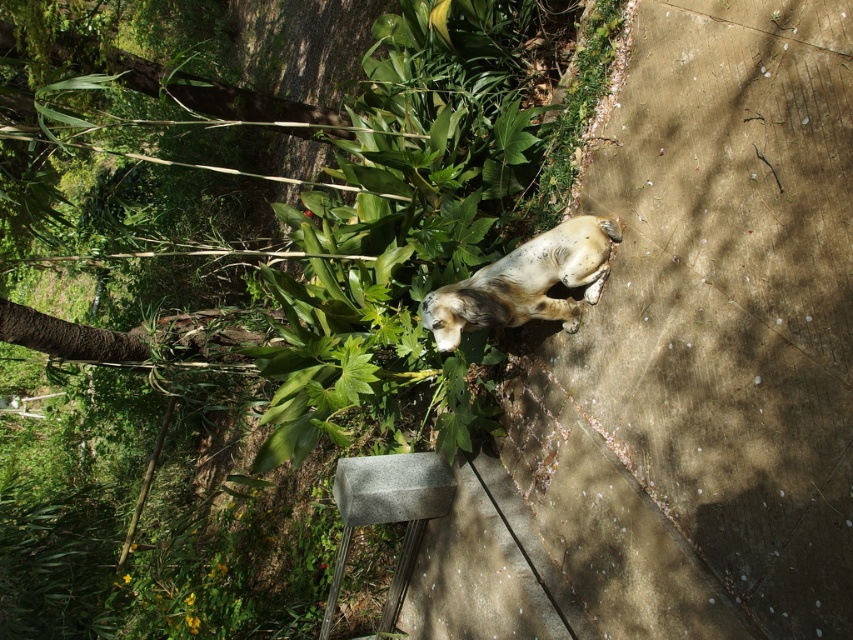
Does speckled fur dog at center appear under gray concrete block at lower center?

No, speckled fur dog at center is not below gray concrete block at lower center.

Does speckled fur dog at center have a larger size compared to gray concrete block at lower center?

Incorrect, speckled fur dog at center is not larger than gray concrete block at lower center.

Is point (485, 324) positioned in front of point (379, 634)?

Yes, point (485, 324) is closer to viewer.

Locate an element on the screen. speckled fur dog at center is located at coordinates (525, 282).